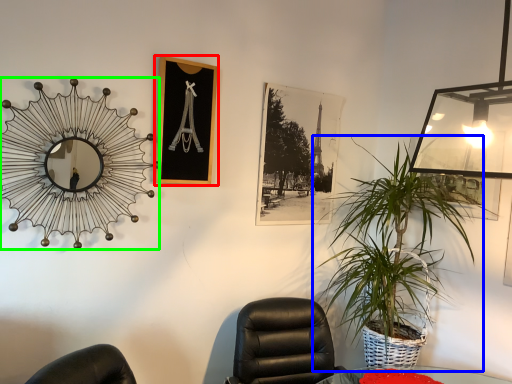
Question: Which is nearer to the picture frame (highlighted by a red box)? houseplant (highlighted by a blue box) or mirror (highlighted by a green box).

Choices:
 (A) houseplant
 (B) mirror

Answer: (B)